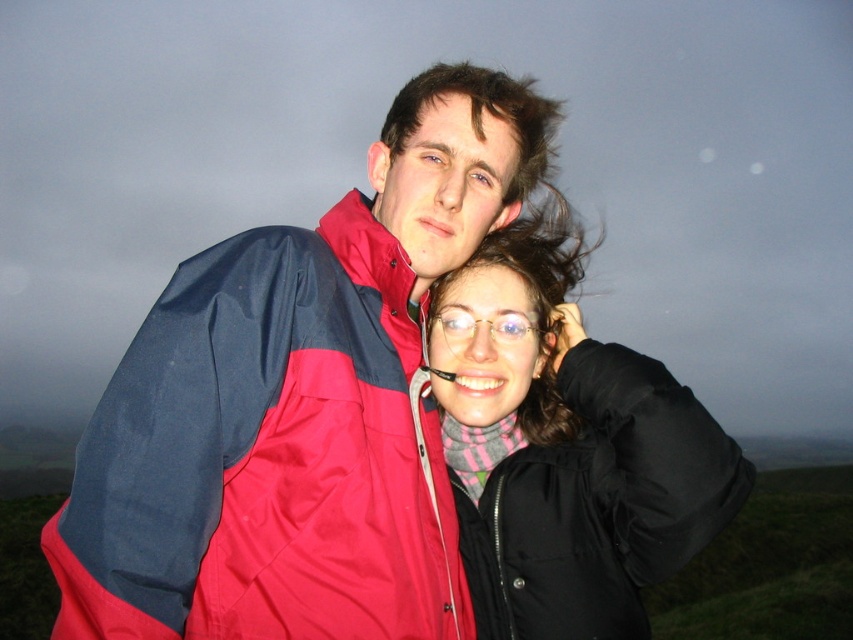
Question: Which point appears closest to the camera in this image?

Choices:
 (A) (223, 616)
 (B) (538, 577)

Answer: (A)

Question: Does red nylon jacket at center have a larger size compared to black matte jacket at center?

Choices:
 (A) yes
 (B) no

Answer: (A)

Question: Which of the following is the farthest from the observer?

Choices:
 (A) black matte jacket at center
 (B) red nylon jacket at center

Answer: (A)

Question: Among these objects, which one is nearest to the camera?

Choices:
 (A) red nylon jacket at center
 (B) black matte jacket at center

Answer: (A)

Question: Is red nylon jacket at center thinner than black matte jacket at center?

Choices:
 (A) no
 (B) yes

Answer: (A)

Question: Is red nylon jacket at center bigger than black matte jacket at center?

Choices:
 (A) no
 (B) yes

Answer: (B)